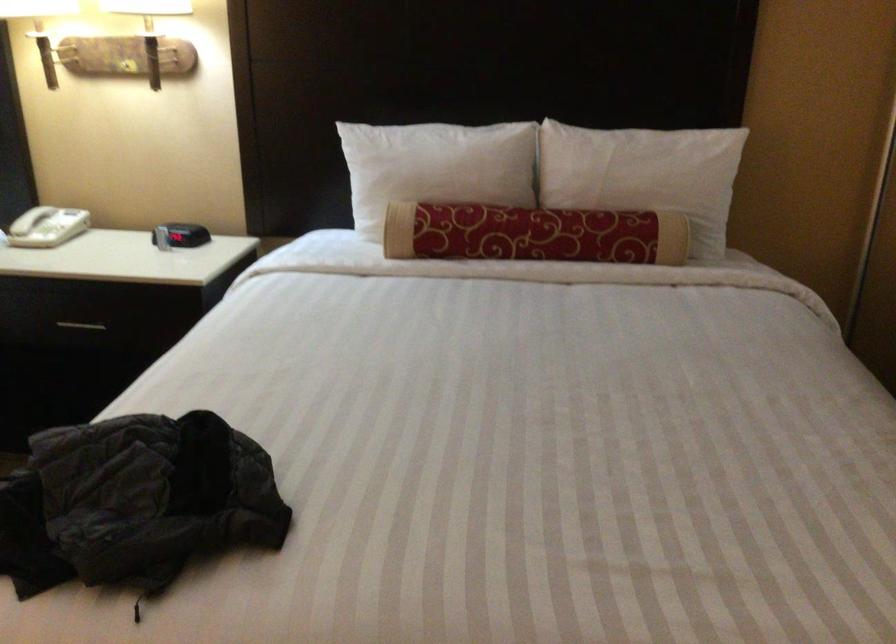
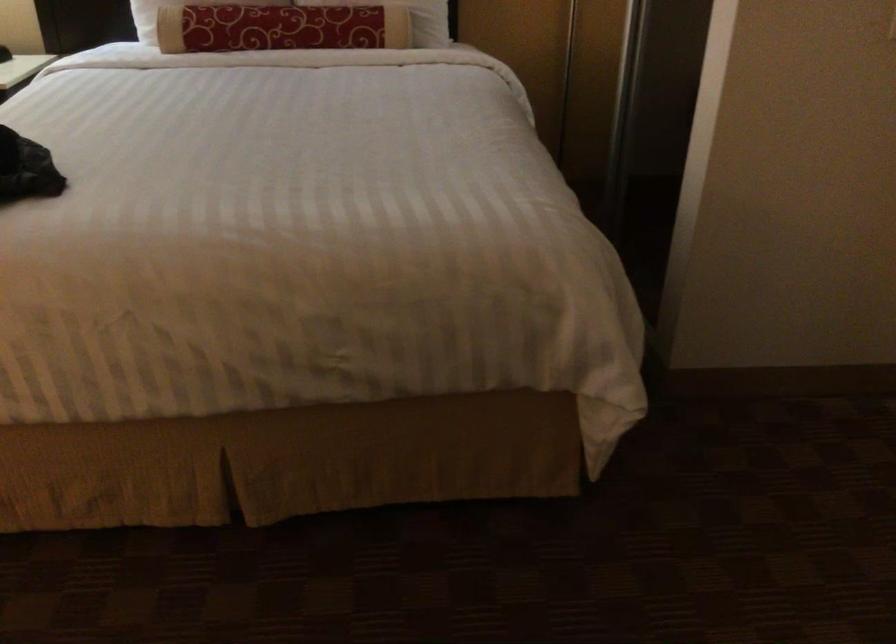
Which direction would the cameraman need to move to produce the second image?

The cameraman moved toward right, backward.